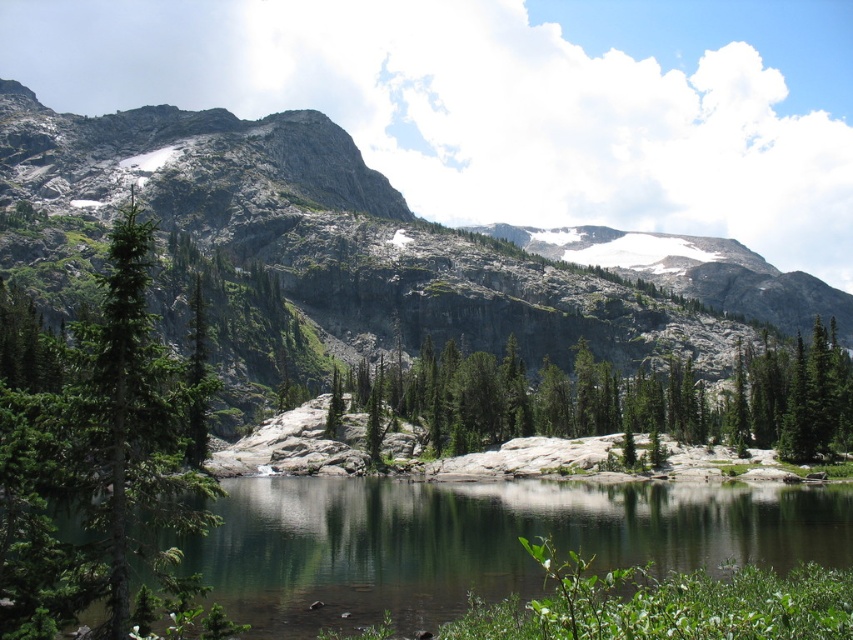
Question: Does clear water at center appear under green matte tree at left?

Choices:
 (A) yes
 (B) no

Answer: (A)

Question: In this image, where is clear water at center located relative to green textured rock at center?

Choices:
 (A) above
 (B) below

Answer: (B)

Question: Is clear water at center smaller than green textured rock at center?

Choices:
 (A) yes
 (B) no

Answer: (A)

Question: Which point is farther from the camera taking this photo?

Choices:
 (A) (776, 504)
 (B) (705, 397)
 (C) (593, 259)

Answer: (C)

Question: Which point is closer to the camera?

Choices:
 (A) clear water at center
 (B) green textured rock at center

Answer: (A)

Question: Which point is closer to the camera?

Choices:
 (A) (341, 577)
 (B) (428, 368)

Answer: (A)